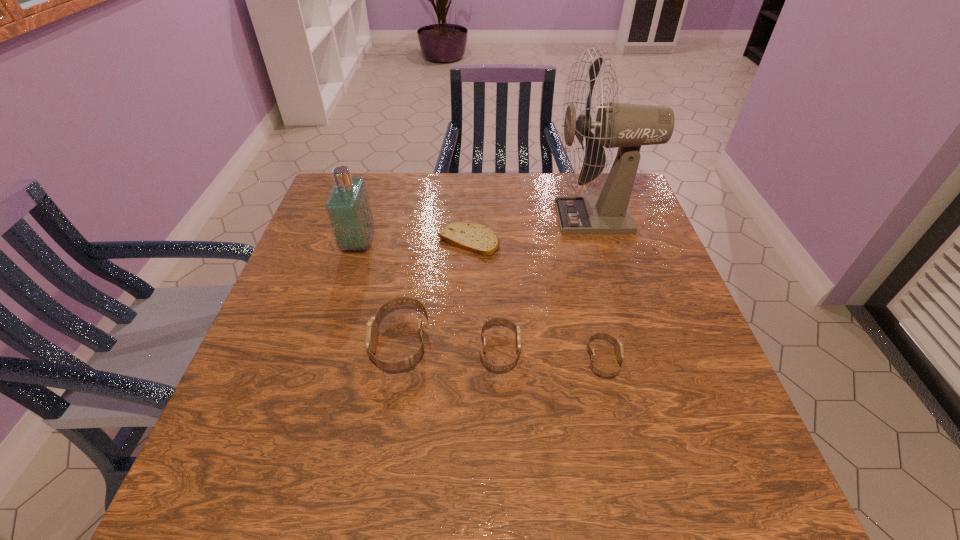
Observe the arrangement of all watchs in the image. To keep them evenly spaced, where would you place another watch on the right? Please locate a free space. Please provide its 2D coordinates. Your answer should be formatted as a tuple, i.e. [(x, y)], where the tuple contains the x and y coordinates of a point satisfying the conditions above.

[(710, 369)]